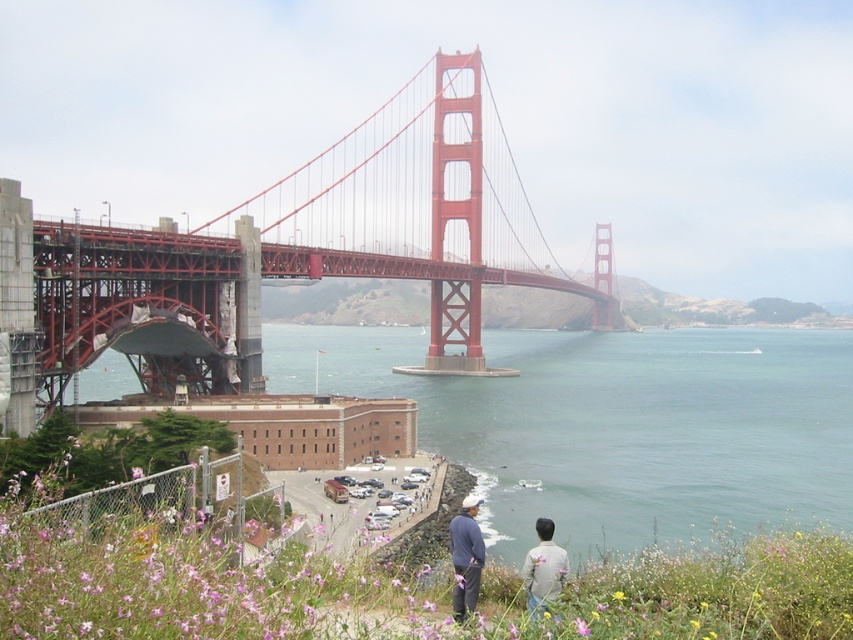
Question: Is matte gray hoodie at lower center wider than gray cotton shirt at lower right?

Choices:
 (A) yes
 (B) no

Answer: (A)

Question: Estimate the real-world distances between objects in this image. Which object is closer to the red steel suspension bridge at center?

Choices:
 (A) clear blue water at center
 (B) gray cotton shirt at lower right
 (C) matte gray hoodie at lower center
 (D) gray fabric pants at center

Answer: (A)

Question: Can you confirm if red steel suspension bridge at center is bigger than matte gray hoodie at lower center?

Choices:
 (A) yes
 (B) no

Answer: (A)

Question: Which point is closer to the camera?

Choices:
 (A) matte gray hoodie at lower center
 (B) gray cotton shirt at lower right
 (C) clear blue water at center

Answer: (B)

Question: Is clear blue water at center further to camera compared to matte gray hoodie at lower center?

Choices:
 (A) yes
 (B) no

Answer: (A)

Question: Which point is farther to the camera?

Choices:
 (A) (453, 563)
 (B) (465, 538)
 (C) (231, 289)

Answer: (C)